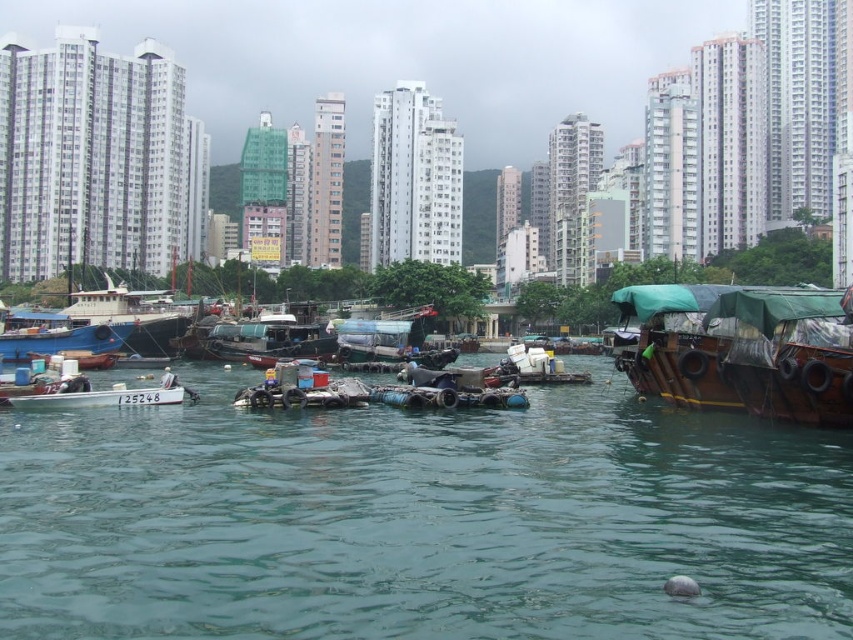
Is point (618, 385) positioned before point (737, 333)?

No, (618, 385) is further to viewer.

Is clear water at center positioned behind green canvas boat at right?

No, it is not.

Find the location of a particular element. clear water at center is located at coordinates (421, 520).

The width and height of the screenshot is (853, 640). What do you see at coordinates (421, 520) in the screenshot?
I see `clear water at center` at bounding box center [421, 520].

Does clear water at center come behind blue matte boat at left?

No, clear water at center is in front of blue matte boat at left.

Which is in front, point (479, 611) or point (115, 337)?

Point (479, 611)

I want to click on clear water at center, so click(421, 520).

Does green canvas boat at right appear over white matte boat at left?

Yes.

Identify the location of green canvas boat at right. The width and height of the screenshot is (853, 640). (788, 353).

Describe the element at coordinates (788, 353) in the screenshot. I see `green canvas boat at right` at that location.

Where is `green canvas boat at right`? This screenshot has width=853, height=640. green canvas boat at right is located at coordinates (788, 353).